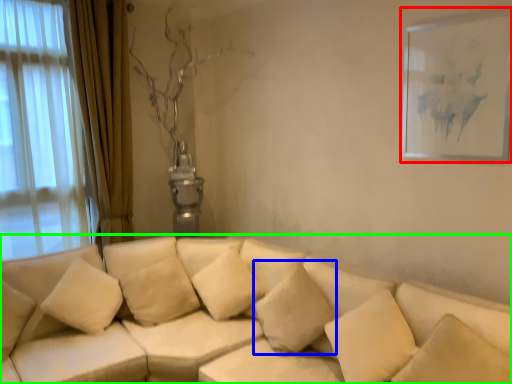
Question: Which is nearer to the picture frame (highlighted by a red box)? pillow (highlighted by a blue box) or studio couch (highlighted by a green box).

Choices:
 (A) pillow
 (B) studio couch

Answer: (A)